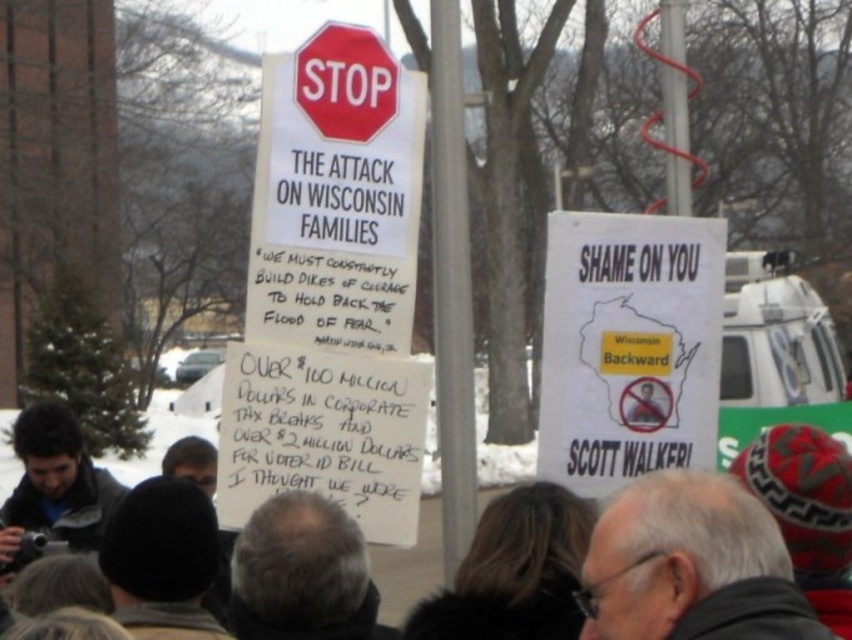
You are a photographer at the protest scene. You notice the dark gray knit hat at center and the dark gray jacket at lower left. Which object is taller?

The dark gray knit hat at center is taller than the dark gray jacket at lower left.

You are a photographer trying to capture a clear shot of the white paper poster at center right and the gray hair at upper right. Which object should you focus on first if you want to ensure both are in focus?

You should focus on the white paper poster at center right first because it is located above the gray hair at upper right, so adjusting focus starting from the closer object might help achieve sharpness for both.

You are a photographer trying to capture the protest scene. You notice the gray hair at upper right and the dark gray knit hat at center. Which object is positioned closer to your camera lens?

The gray hair at upper right is closer to the viewer than the dark gray knit hat at center, so the gray hair at upper right would be closer to your camera lens.